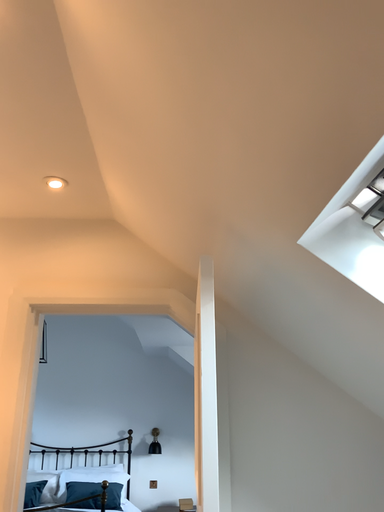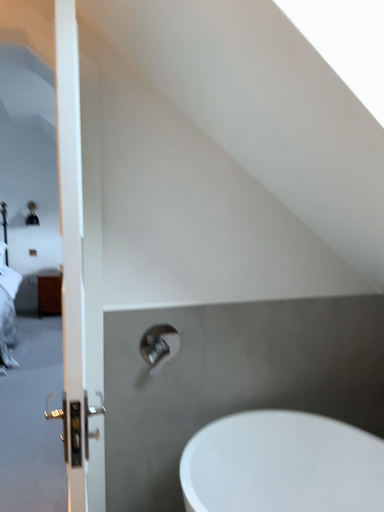
Question: How did the camera likely rotate when shooting the video?

Choices:
 (A) rotated upward
 (B) rotated downward

Answer: (B)